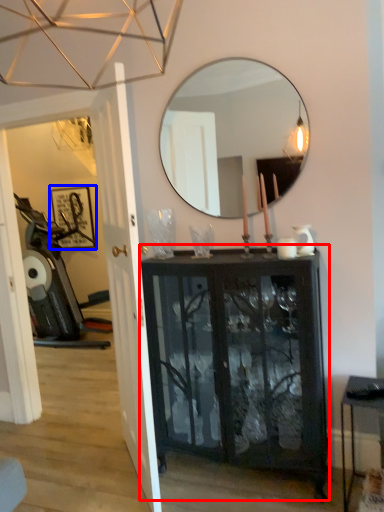
Question: Which object appears farthest to the camera in this image, cabinetry (highlighted by a red box) or picture frame (highlighted by a blue box)?

Choices:
 (A) cabinetry
 (B) picture frame

Answer: (B)